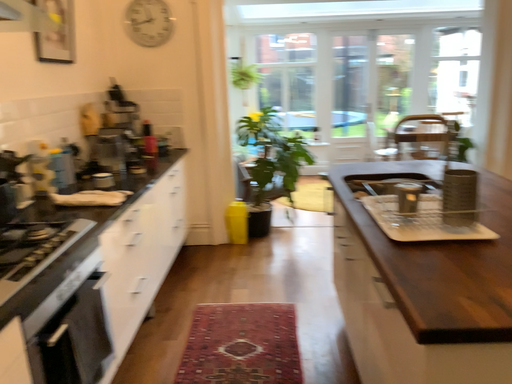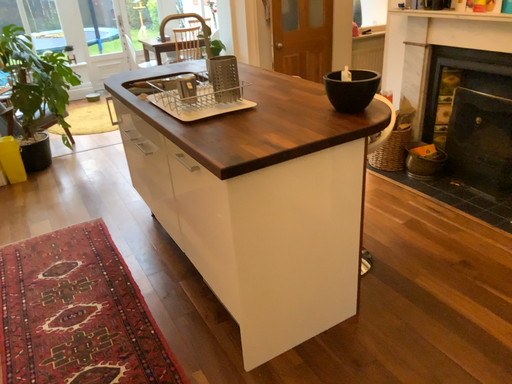
Question: Which way did the camera rotate in the video?

Choices:
 (A) rotated downward
 (B) rotated upward

Answer: (A)